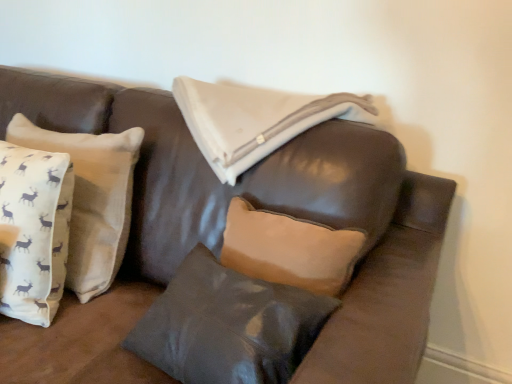
Question: Visually, is white cotton cushion at left, which ranks as the 2th pillow in right-to-left order, positioned to the left or to the right of matte gray pillow at center, arranged as the second pillow when viewed from the left?

Choices:
 (A) right
 (B) left

Answer: (B)

Question: In terms of height, does white cotton cushion at left, which ranks as the 2th pillow in right-to-left order, look taller or shorter compared to matte gray pillow at center, acting as the 1th pillow starting from the right?

Choices:
 (A) short
 (B) tall

Answer: (B)

Question: Looking at the image, does white cotton cushion at left, the first pillow from the left, seem bigger or smaller compared to matte gray pillow at center, arranged as the second pillow when viewed from the left?

Choices:
 (A) small
 (B) big

Answer: (B)

Question: Considering the positions of matte gray pillow at center, acting as the 1th pillow starting from the right, and white cotton cushion at left, the first pillow from the left, in the image, is matte gray pillow at center, acting as the 1th pillow starting from the right, wider or thinner than white cotton cushion at left, the first pillow from the left,?

Choices:
 (A) thin
 (B) wide

Answer: (B)

Question: Is matte gray pillow at center, acting as the 1th pillow starting from the right, bigger or smaller than white cotton cushion at left, the first pillow from the left?

Choices:
 (A) big
 (B) small

Answer: (B)

Question: Considering the positions of point (318, 316) and point (100, 140), is point (318, 316) closer or farther from the camera than point (100, 140)?

Choices:
 (A) closer
 (B) farther

Answer: (A)

Question: Would you say matte gray pillow at center, acting as the 1th pillow starting from the right, is to the left or to the right of white cotton cushion at left, which ranks as the 2th pillow in right-to-left order, in the picture?

Choices:
 (A) right
 (B) left

Answer: (A)